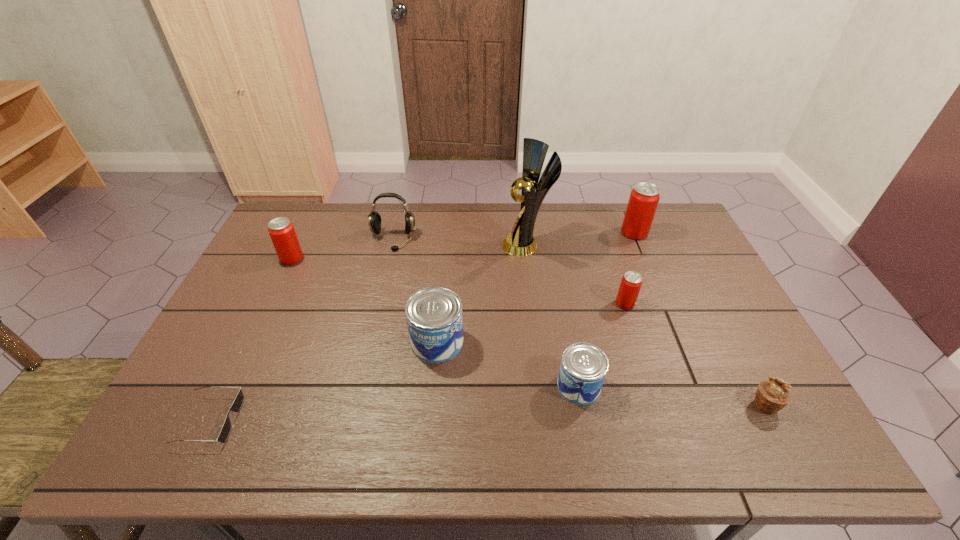
At what (x,y) coordinates should I click in order to perform the action: click on the third nearest can. Please return your answer as a coordinate pair (x, y). The height and width of the screenshot is (540, 960). Looking at the image, I should click on (631, 282).

Where is `the nearest can`? The height and width of the screenshot is (540, 960). the nearest can is located at coordinates (583, 368).

Locate an element on the screen. the nearer blue can is located at coordinates (583, 368).

Locate an element on the screen. the rightmost object is located at coordinates (772, 395).

Where is `sunglasses`? sunglasses is located at coordinates (237, 404).

What are the coordinates of `vacant space positioned at the front of the award, where the globe is visible` in the screenshot? It's located at (385, 245).

Identify the location of free location located 0.390m at the front of the award, where the globe is visible. This screenshot has width=960, height=540. (388, 245).

Locate an element on the screen. This screenshot has height=540, width=960. vacant space located 0.240m at the front of the award, where the globe is visible is located at coordinates (432, 245).

Find the location of a particular element. vacant space located on the left of the biggest red can is located at coordinates (564, 233).

Locate an element on the screen. The width and height of the screenshot is (960, 540). vacant space located 0.190m with the microphone on the side of the seventh object from right to left is located at coordinates (380, 292).